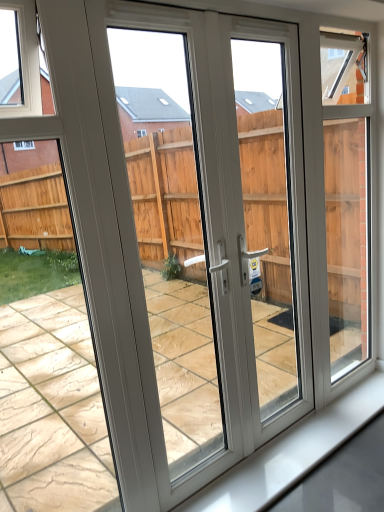
Question: Does white plastic screen door at center, the first screen door viewed from the right, touch white plastic screen door at center, which is the second screen door in right-to-left order?

Choices:
 (A) yes
 (B) no

Answer: (B)

Question: Are white plastic screen door at center, placed as the 2th screen door when sorted from left to right, and white plastic screen door at center, placed as the first screen door when sorted from left to right, located far from each other?

Choices:
 (A) no
 (B) yes

Answer: (A)

Question: From a real-world perspective, is white plastic screen door at center, the first screen door viewed from the right, under white plastic screen door at center, which is the second screen door in right-to-left order?

Choices:
 (A) no
 (B) yes

Answer: (B)

Question: From the image's perspective, is white plastic screen door at center, placed as the 2th screen door when sorted from left to right, over white plastic screen door at center, placed as the first screen door when sorted from left to right?

Choices:
 (A) no
 (B) yes

Answer: (B)

Question: Would you say white plastic screen door at center, the first screen door viewed from the right, is outside white plastic screen door at center, which is the second screen door in right-to-left order?

Choices:
 (A) yes
 (B) no

Answer: (A)

Question: From the image's perspective, is white plastic screen door at center, which is the second screen door in right-to-left order, located above or below white plastic screen door at center, the first screen door viewed from the right?

Choices:
 (A) above
 (B) below

Answer: (B)

Question: Considering the positions of white plastic screen door at center, placed as the first screen door when sorted from left to right, and white plastic screen door at center, placed as the 2th screen door when sorted from left to right, in the image, is white plastic screen door at center, placed as the first screen door when sorted from left to right, wider or thinner than white plastic screen door at center, placed as the 2th screen door when sorted from left to right,?

Choices:
 (A) wide
 (B) thin

Answer: (A)

Question: From a real-world perspective, is white plastic screen door at center, which is the second screen door in right-to-left order, positioned above or below white plastic screen door at center, the first screen door viewed from the right?

Choices:
 (A) below
 (B) above

Answer: (B)

Question: Considering their positions, is white plastic screen door at center, which is the second screen door in right-to-left order, located in front of or behind white plastic screen door at center, placed as the 2th screen door when sorted from left to right?

Choices:
 (A) behind
 (B) front

Answer: (B)

Question: From a real-world perspective, relative to white plastic screen door at center, the first screen door viewed from the right, is white glossy window sill at lower center vertically above or below?

Choices:
 (A) above
 (B) below

Answer: (B)

Question: In terms of height, does white glossy window sill at lower center look taller or shorter compared to white plastic screen door at center, the first screen door viewed from the right?

Choices:
 (A) short
 (B) tall

Answer: (A)

Question: From the image's perspective, is white glossy window sill at lower center located above or below white plastic screen door at center, the first screen door viewed from the right?

Choices:
 (A) below
 (B) above

Answer: (A)

Question: Considering the positions of point (296, 440) and point (241, 103), is point (296, 440) closer or farther from the camera than point (241, 103)?

Choices:
 (A) farther
 (B) closer

Answer: (B)

Question: From a real-world perspective, relative to white glossy window sill at lower center, is white plastic screen door at center, the first screen door viewed from the right, vertically above or below?

Choices:
 (A) above
 (B) below

Answer: (A)

Question: Looking at their shapes, would you say white plastic screen door at center, the first screen door viewed from the right, is wider or thinner than white glossy window sill at lower center?

Choices:
 (A) wide
 (B) thin

Answer: (B)